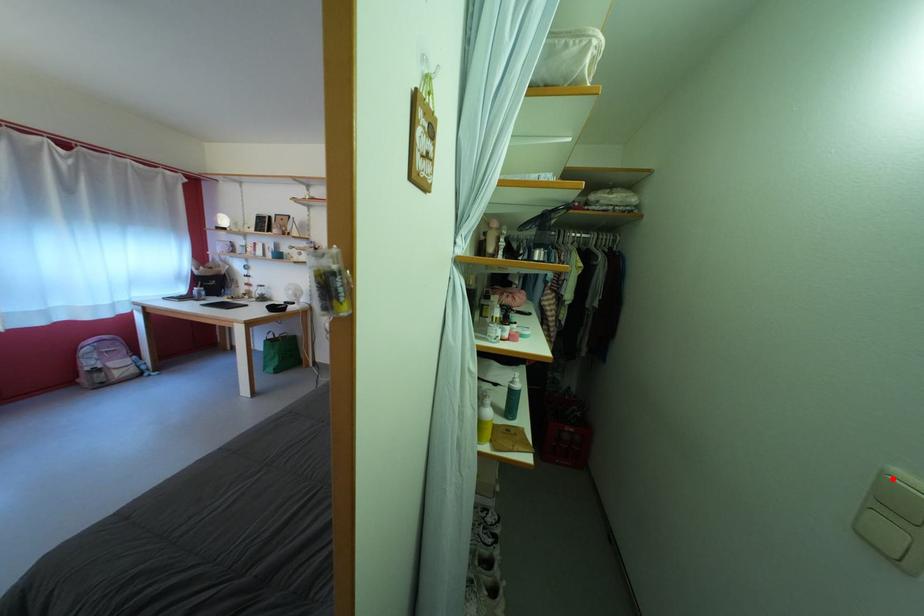
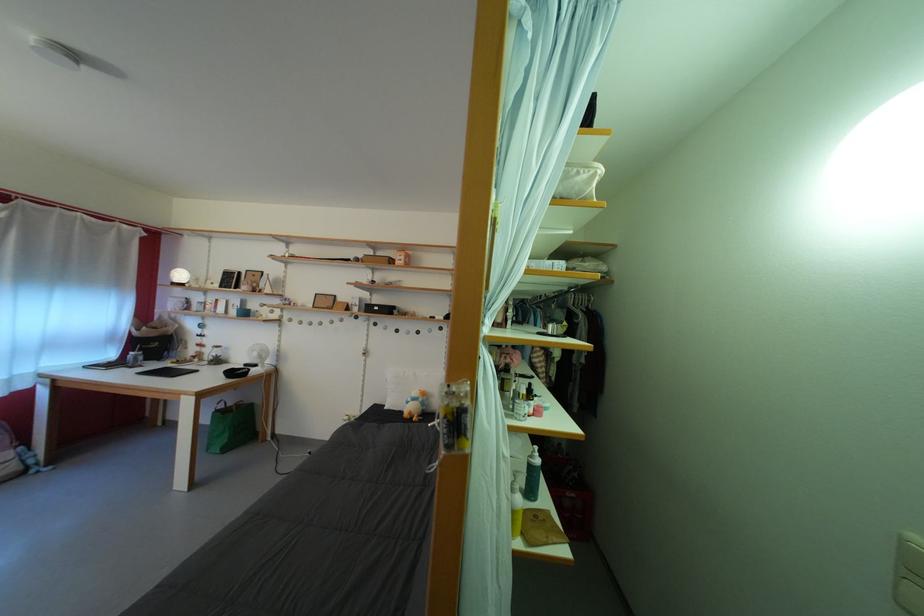
Find the pixel in the second image that matches the highlighted location in the first image.

(913, 545)